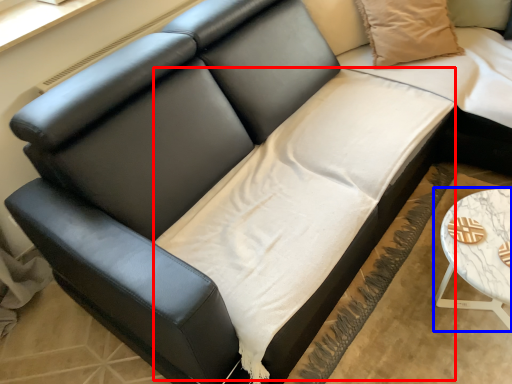
Question: Which object is closer to the camera taking this photo, sheet (highlighted by a red box) or table (highlighted by a blue box)?

Choices:
 (A) sheet
 (B) table

Answer: (A)